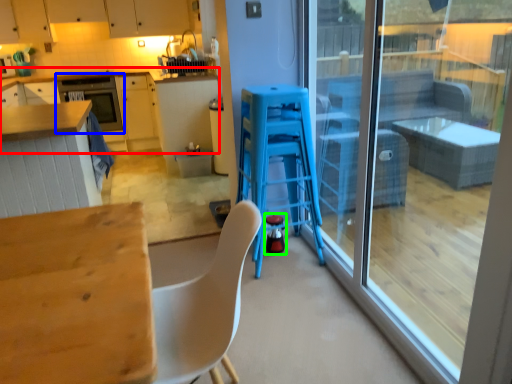
Question: Estimate the real-world distances between objects in this image. Which object is farther from cabinetry (highlighted by a red box), oven (highlighted by a blue box) or appliance (highlighted by a green box)?

Choices:
 (A) oven
 (B) appliance

Answer: (B)